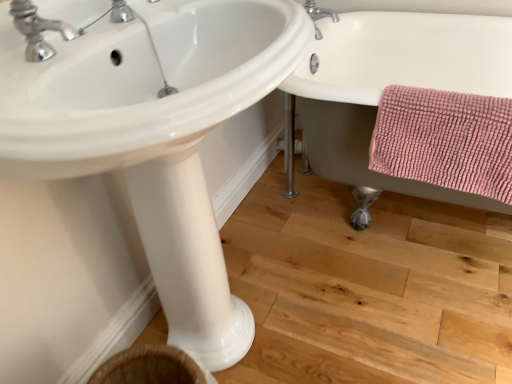
Question: In terms of width, does white ceramic bathtub at right look wider or thinner when compared to silver metallic faucet at upper center, placed as the 2th tap when sorted from front to back?

Choices:
 (A) wide
 (B) thin

Answer: (A)

Question: Does point (376, 195) appear closer or farther from the camera than point (307, 1)?

Choices:
 (A) closer
 (B) farther

Answer: (A)

Question: Estimate the real-world distances between objects in this image. Which object is closer to the silver metallic faucet at upper center, which is the first tap from right to left?

Choices:
 (A) white ceramic bathtub at right
 (B) pink chenille bath towel at lower right
 (C) white glossy pedestal at center
 (D) chrome metallic faucet at upper left, the first tap from the left
 (E) white glossy sink at center

Answer: (A)

Question: Estimate the real-world distances between objects in this image. Which object is closer to the silver metallic faucet at upper center, the 2th tap positioned from the bottom?

Choices:
 (A) chrome metallic faucet at upper left, the second tap viewed from the back
 (B) white glossy sink at center
 (C) white ceramic bathtub at right
 (D) white glossy pedestal at center
 (E) pink chenille bath towel at lower right

Answer: (C)